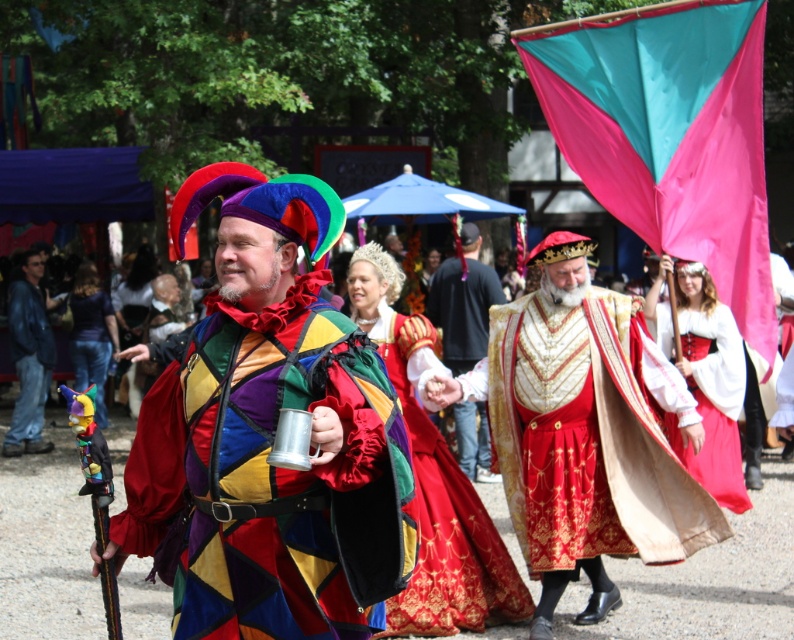
Is metallic silver tankard at center positioned behind velvet red dress at center?

Yes, it is.

Describe the element at coordinates (708, 580) in the screenshot. Image resolution: width=794 pixels, height=640 pixels. I see `metallic silver tankard at center` at that location.

The width and height of the screenshot is (794, 640). What are the coordinates of `metallic silver tankard at center` in the screenshot? It's located at (708, 580).

Between point (451, 516) and point (719, 314), which one is positioned in front?

Point (451, 516) is more forward.

Between velvet red dress at center and white satin dress at center, which one is positioned lower?

Positioned lower is velvet red dress at center.

This screenshot has height=640, width=794. What do you see at coordinates (445, 522) in the screenshot?
I see `velvet red dress at center` at bounding box center [445, 522].

Where is `velvet red dress at center`? velvet red dress at center is located at coordinates (445, 522).

Is metallic silver tankard at center wider than brushed metal mug at left?

Correct, the width of metallic silver tankard at center exceeds that of brushed metal mug at left.

Does metallic silver tankard at center come behind brushed metal mug at left?

No, it is not.

Is point (41, 579) positioned behind point (35, 273)?

No.

The width and height of the screenshot is (794, 640). Find the location of `metallic silver tankard at center`. metallic silver tankard at center is located at coordinates pos(708,580).